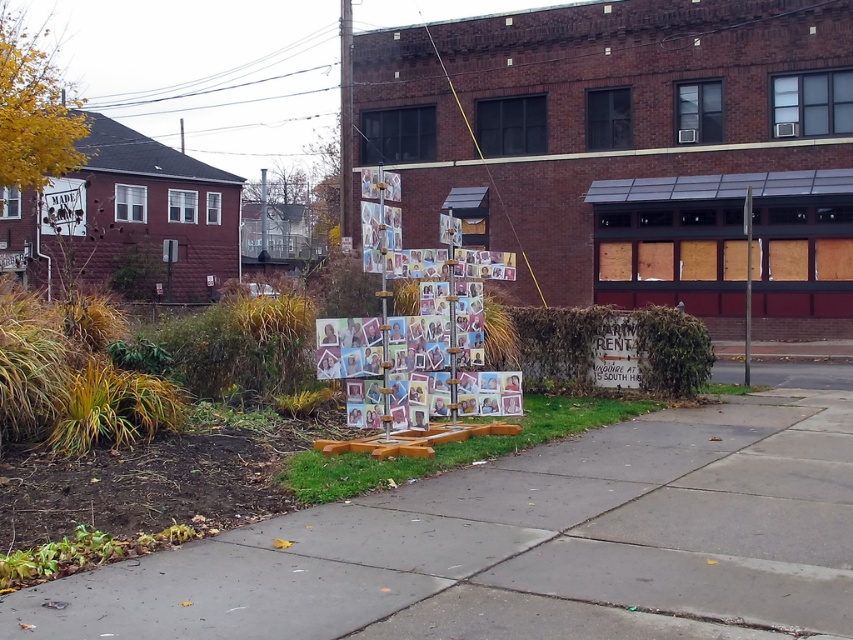
Question: In this image, where is concrete sidewalk at center located relative to brushed metal sign at upper left?

Choices:
 (A) above
 (B) below

Answer: (B)

Question: Which point is closer to the camera taking this photo?

Choices:
 (A) (354, 410)
 (B) (68, 204)
 (C) (827, 540)

Answer: (C)

Question: Considering the relative positions of concrete sidewalk at center and brushed metal sign at upper left in the image provided, where is concrete sidewalk at center located with respect to brushed metal sign at upper left?

Choices:
 (A) above
 (B) below

Answer: (B)

Question: Which point appears farthest from the camera in this image?

Choices:
 (A) (45, 202)
 (B) (415, 337)
 (C) (579, 456)

Answer: (A)

Question: Is concrete sidewalk at center wider than brushed metal sign at upper left?

Choices:
 (A) no
 (B) yes

Answer: (B)

Question: Which point is closer to the camera taking this photo?

Choices:
 (A) (419, 298)
 (B) (76, 198)
 (C) (96, 627)

Answer: (C)